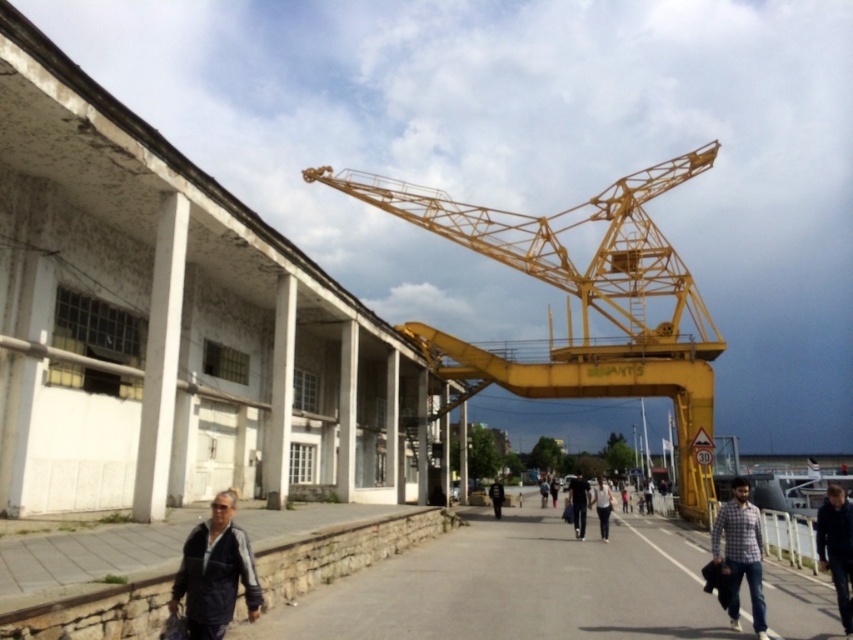
Question: Does dark gray jacket at lower left appear over light blue jeans at center?

Choices:
 (A) yes
 (B) no

Answer: (A)

Question: Is dark blue jeans at center smaller than black leather jacket at center?

Choices:
 (A) no
 (B) yes

Answer: (A)

Question: Can you confirm if yellow metallic crane at center is positioned above dark blue jacket at lower right?

Choices:
 (A) no
 (B) yes

Answer: (B)

Question: Which object appears farthest from the camera in this image?

Choices:
 (A) light blue jeans at center
 (B) black leather jacket at center

Answer: (B)

Question: Estimate the real-world distances between objects in this image. Which object is closer to the plaid cotton shirt at lower right?

Choices:
 (A) light blue jeans at center
 (B) yellow metallic crane at center
 (C) dark blue jacket at lower right

Answer: (C)

Question: Which point is farther from the camera taking this photo?

Choices:
 (A) (196, 604)
 (B) (502, 490)
 (C) (578, 484)

Answer: (B)